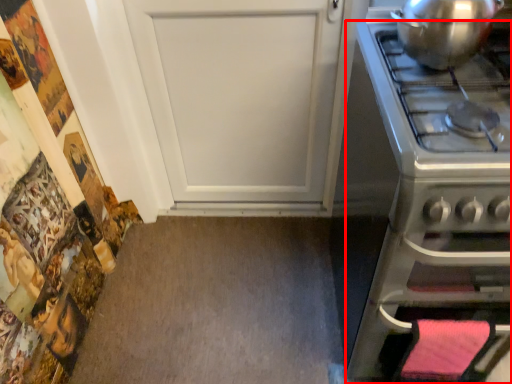
Question: From the image's perspective, what is the correct spatial positioning of oven (annotated by the red box) in reference to kitchen appliance?

Choices:
 (A) below
 (B) above

Answer: (A)